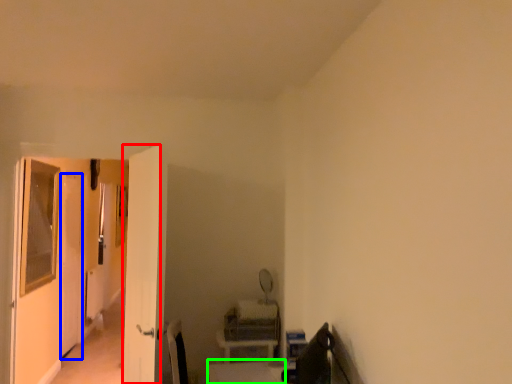
Question: Which is farther away from screen door (highlighted by a red box)? screen door (highlighted by a blue box) or table (highlighted by a green box)?

Choices:
 (A) screen door
 (B) table

Answer: (A)